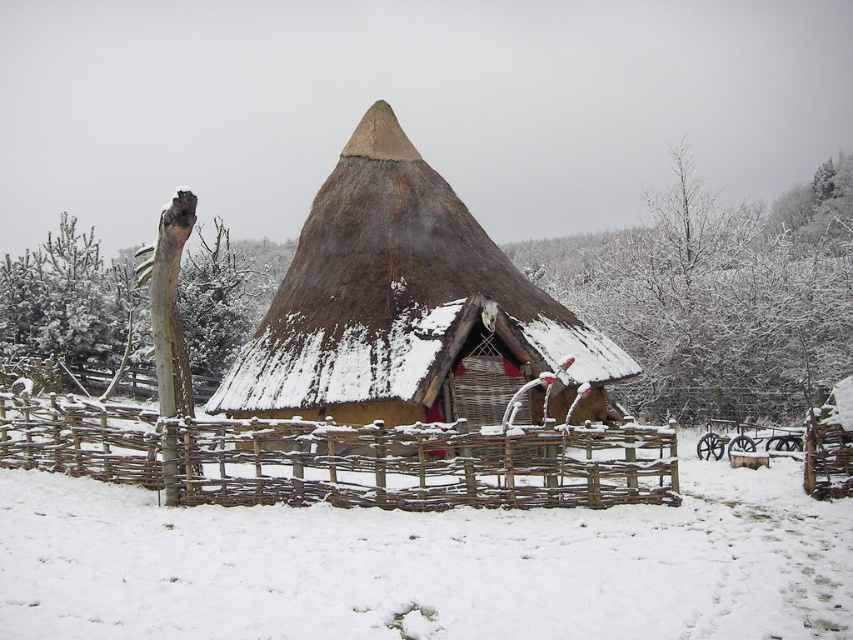
You are a delivery person trying to deliver a package to the rustic, traditional hut in the snowy landscape. The package requires a flat surface to place it safely. You see the white fluffy snow at center and the woven wood fence at center. Which surface is more suitable for placing the package?

The white fluffy snow at center is more suitable for placing the package because the woven wood fence at center is 38.47 inches away from it, making the snow a flatter and more stable surface.

You are standing in front of the rustic, traditional hut in the snowy landscape. You notice the white fluffy snow at center and the thatched straw hut at center. Which object is closer to you?

The white fluffy snow at center is closer to the viewer than the thatched straw hut at center.

You are standing at the wooden post in front of the hut and want to walk towards the point marked as point (403, 250). Will you pass by point (212, 496) before reaching your destination?

Yes, because point (403, 250) is behind point (212, 496) from your current position at the wooden post, so you will pass point (212, 496) first before reaching point (403, 250).